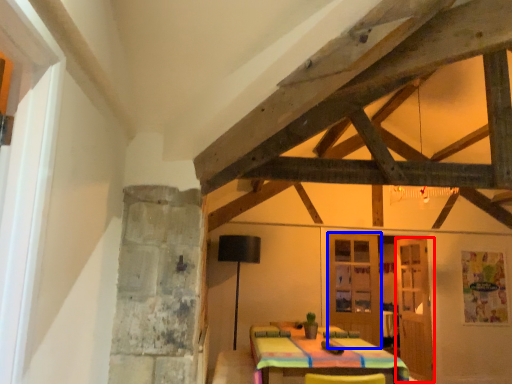
Question: Which of the following is the closest to the observer, door (highlighted by a red box) or door (highlighted by a blue box)?

Choices:
 (A) door
 (B) door

Answer: (B)